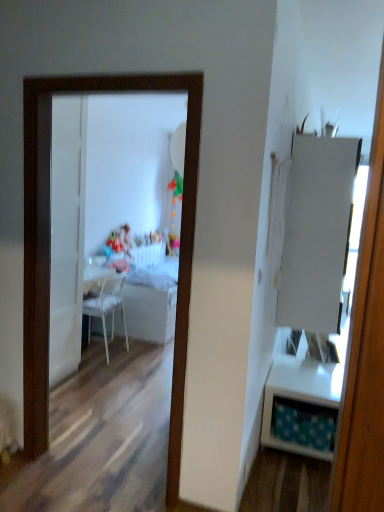
In order to click on space that is in front of white glossy mirror at center in this screenshot , I will do `click(76, 495)`.